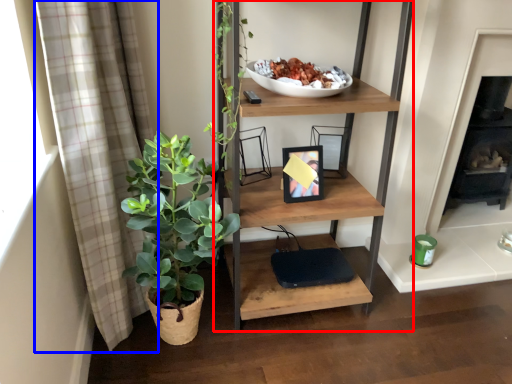
Question: Which object appears farthest to the camera in this image, shelf (highlighted by a red box) or curtain (highlighted by a blue box)?

Choices:
 (A) shelf
 (B) curtain

Answer: (A)